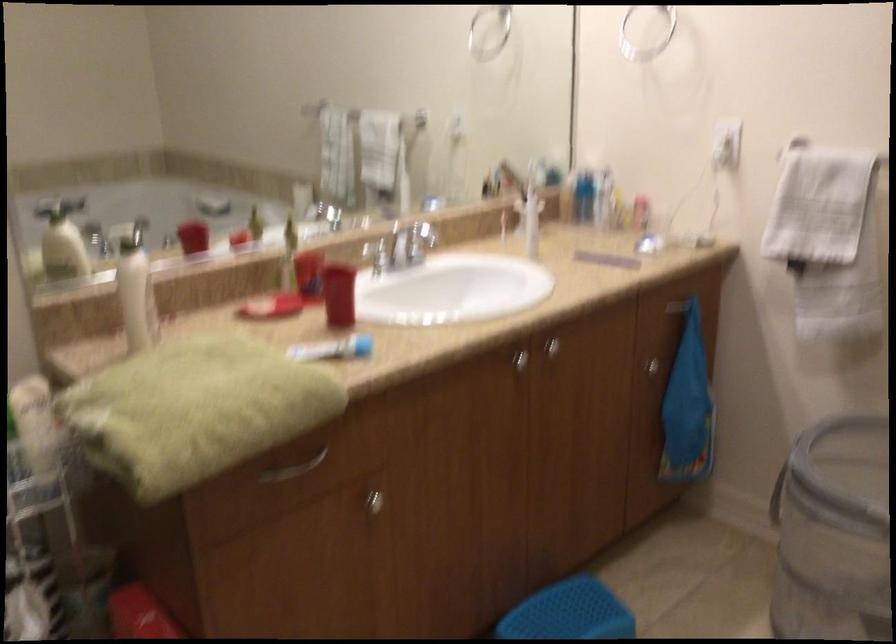
Which object does [339,294] point to?

It corresponds to the red plastic cup in the image.